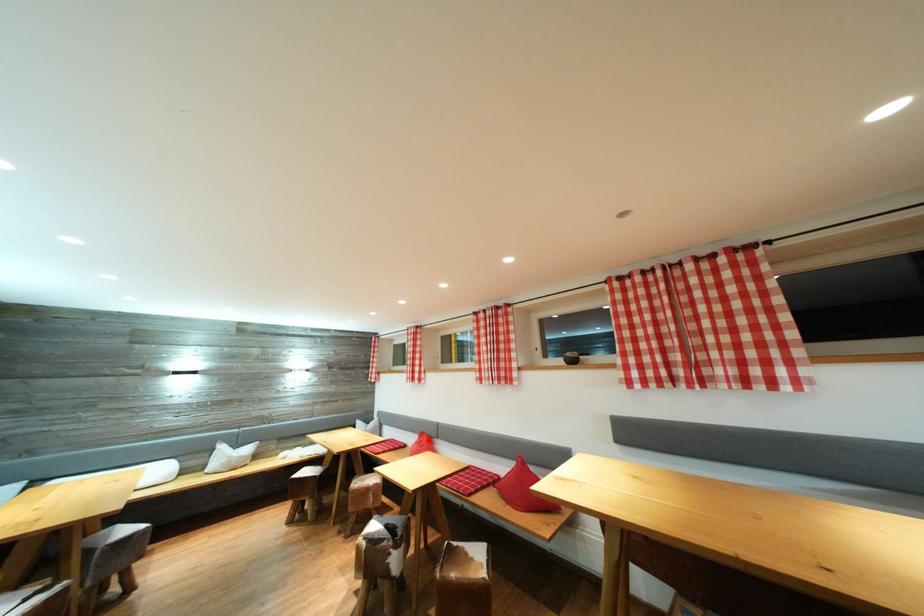
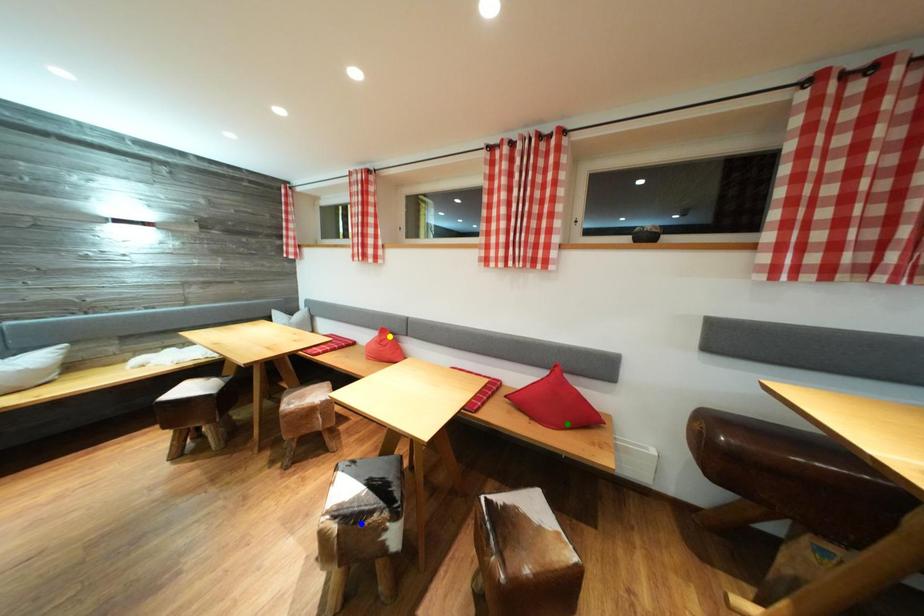
Question: I am providing you with two images of the same scene from different viewpoints. A red point is marked on the first image. You are given multiple points on the second image. Which spot in image 2 lines up with the point in image 1?

Choices:
 (A) yellow point
 (B) blue point
 (C) green point

Answer: (A)